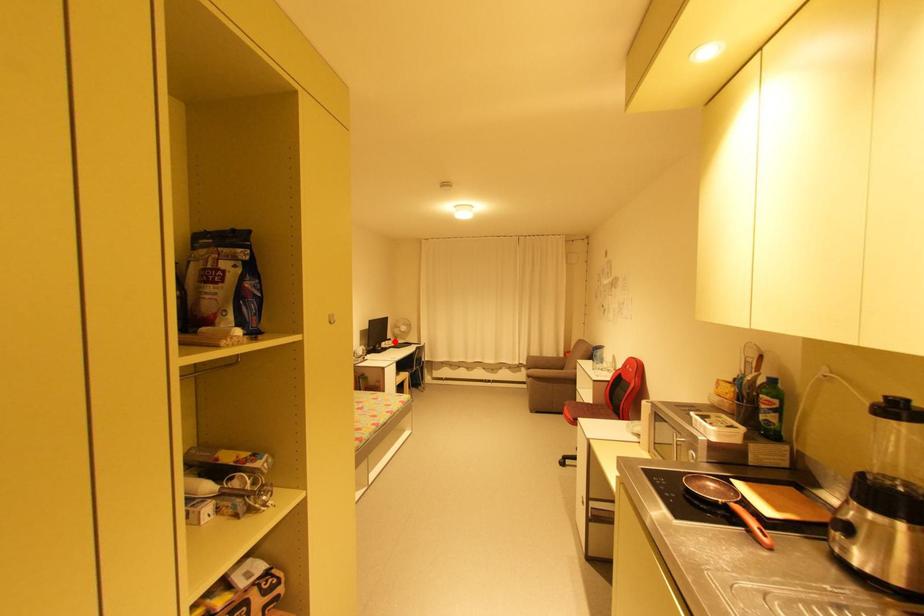
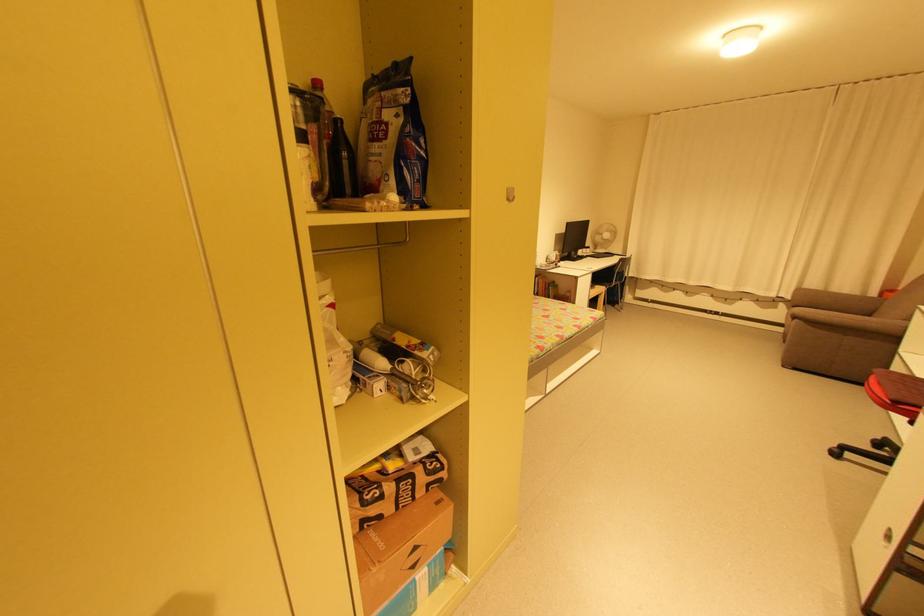
Locate, in the second image, the point that corresponds to the highlighted location in the first image.

(592, 249)